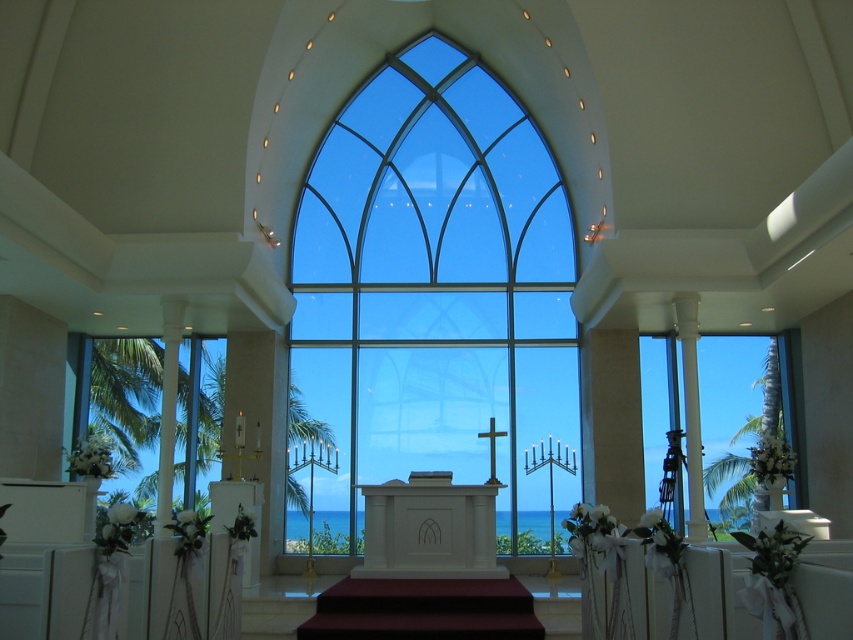
Does transparent glass window at center appear under transparent glass window at right?

No.

Is point (293, 358) positioned behind point (656, 452)?

That is True.

The image size is (853, 640). In order to click on transparent glass window at center in this screenshot , I will do `click(434, 289)`.

Can you confirm if transparent glass window at center is shorter than clear glass window at left?

Correct, transparent glass window at center is not as tall as clear glass window at left.

Is transparent glass window at center below clear glass window at left?

No.

Does point (393, 236) lie behind point (218, 397)?

Yes.

Locate an element on the screen. The width and height of the screenshot is (853, 640). transparent glass window at center is located at coordinates (434, 289).

Does transparent glass window at right appear under clear glass window at left?

Correct, transparent glass window at right is located below clear glass window at left.

Describe the element at coordinates (730, 420) in the screenshot. The image size is (853, 640). I see `transparent glass window at right` at that location.

Image resolution: width=853 pixels, height=640 pixels. I want to click on transparent glass window at right, so click(730, 420).